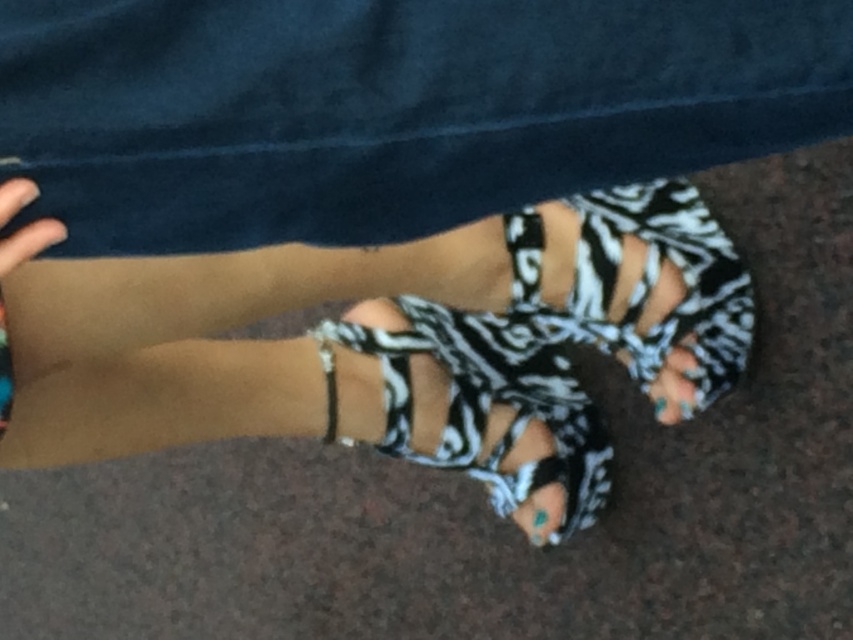
Can you confirm if zebra-patterned fabric sandal at lower center is thinner than zebra-patterned toe at lower right?

No.

Image resolution: width=853 pixels, height=640 pixels. In order to click on zebra-patterned fabric sandal at lower center in this screenshot , I will do `click(490, 403)`.

Where is `zebra-patterned fabric sandal at lower center`? This screenshot has height=640, width=853. zebra-patterned fabric sandal at lower center is located at coordinates (490, 403).